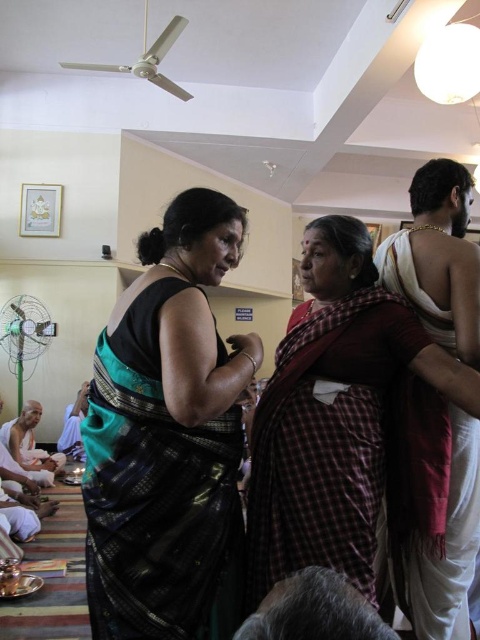
You are an event planner organizing a cultural event and need to arrange seating for two guests wearing the black silk saree at center and the red plaid sari at center. Since both are standing at the center, which guest should you prioritize moving first to avoid blocking the aisle?

The black silk saree at center should be prioritized to move first because it is positioned over the red plaid sari at center, meaning it is closer to the aisle and blocking the path.